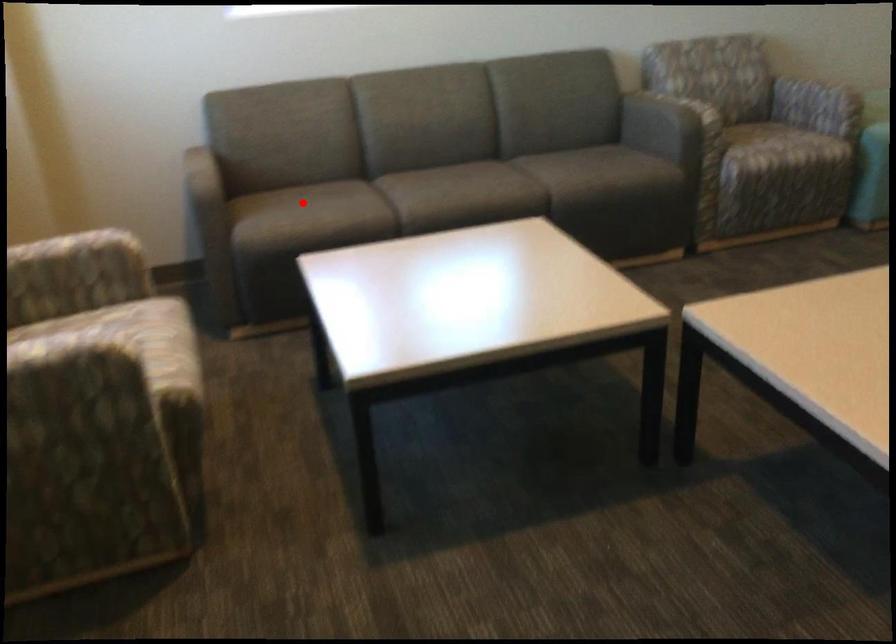
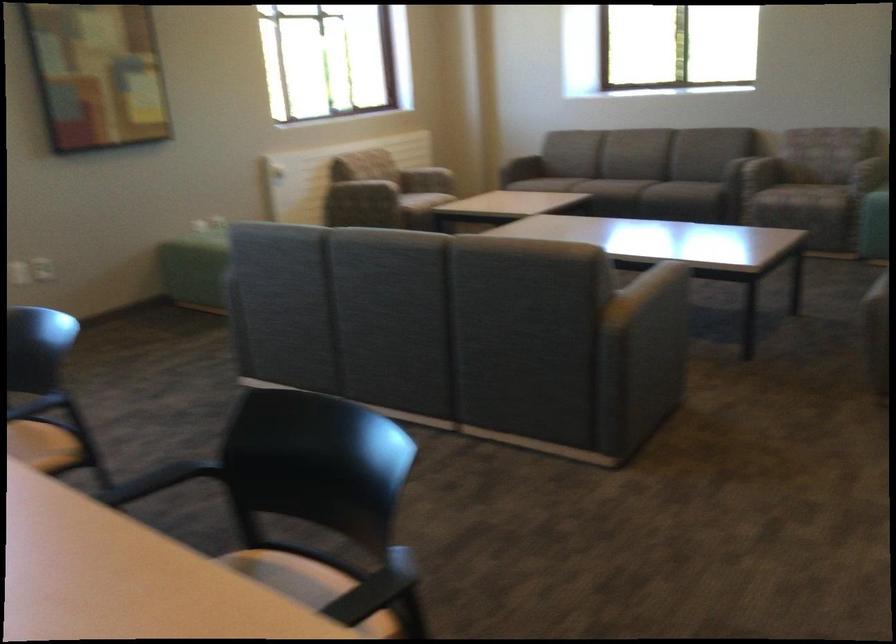
Question: I am providing you with two images of the same scene from different viewpoints. In image1, a red point is highlighted. Considering the same 3D point in image2, which of the following is correct?

Choices:
 (A) It is closer
 (B) It is farther

Answer: (B)